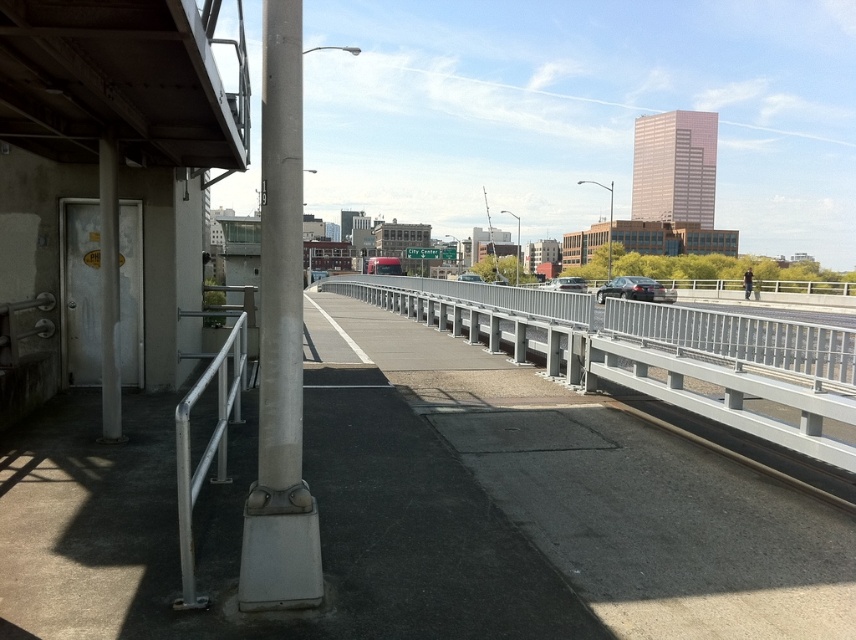
Is metallic gray overpass at upper left closer to the viewer compared to silver metallic rail at left?

Yes, it is in front of silver metallic rail at left.

In the scene shown: How far apart are metallic gray overpass at upper left and silver metallic rail at left?

A distance of 19.54 meters exists between metallic gray overpass at upper left and silver metallic rail at left.

Is point (21, 97) positioned in front of point (204, 600)?

No, (21, 97) is behind (204, 600).

You are a GUI agent. You are given a task and a screenshot of the screen. Output one action in this format:
    pyautogui.click(x=<x>, y=<y>)
    Task: Click on the metallic gray overpass at upper left
    This screenshot has width=856, height=640.
    Given the screenshot: What is the action you would take?
    pyautogui.click(x=119, y=83)

Is silver metallic rail at left thinner than satin black sedan at center?

Correct, silver metallic rail at left's width is less than satin black sedan at center's.

The width and height of the screenshot is (856, 640). In order to click on silver metallic rail at left in this screenshot , I will do `click(207, 445)`.

Does point (265, 518) come behind point (105, 289)?

No.

At what (x,y) coordinates should I click in order to perform the action: click on satin silver pole at left. Please return your answer as a coordinate pair (x, y). This screenshot has height=640, width=856. Looking at the image, I should click on (280, 344).